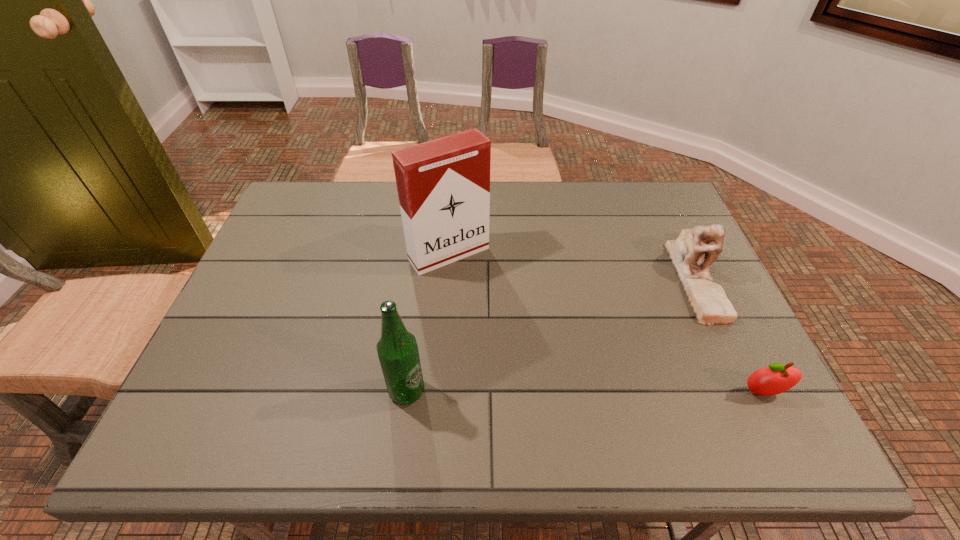
Where is `free spot between the beer bottle and the apple`? free spot between the beer bottle and the apple is located at coordinates (585, 392).

In order to click on vacant space in between the cigarette_case and the third tallest object in this screenshot , I will do `click(572, 266)`.

You are a GUI agent. You are given a task and a screenshot of the screen. Output one action in this format:
    pyautogui.click(x=<x>, y=<y>)
    Task: Click on the vacant point located between the second tallest object and the tallest object
    
    Given the screenshot: What is the action you would take?
    pyautogui.click(x=428, y=322)

Identify which object is the closest to the tallest object. Please provide its 2D coordinates. Your answer should be formatted as a tuple, i.e. [(x, y)], where the tuple contains the x and y coordinates of a point satisfying the conditions above.

[(397, 349)]

Locate an element on the screen. the third closest object relative to the tallest object is located at coordinates (777, 378).